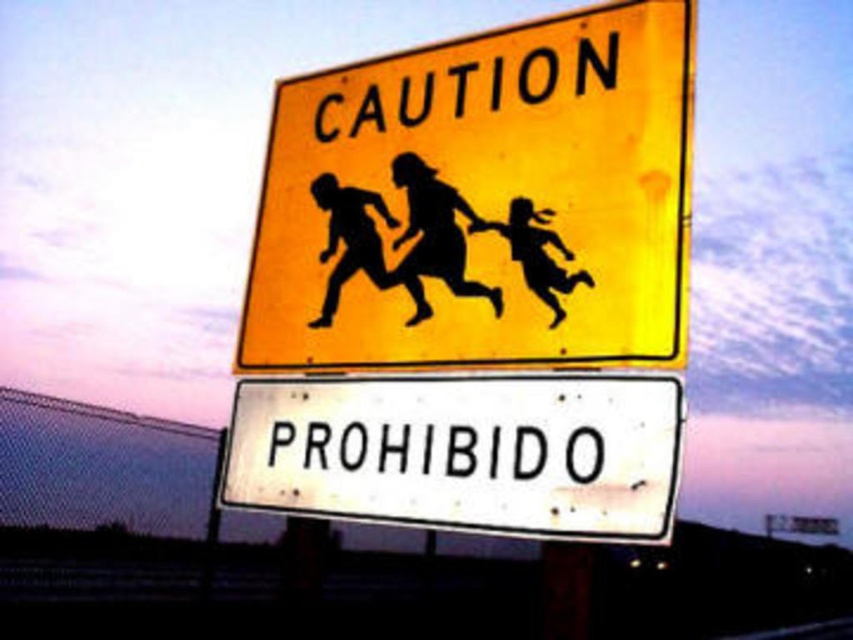
Question: Can you confirm if yellow matte caution sign at upper center is positioned to the right of white matte sign at center?

Choices:
 (A) no
 (B) yes

Answer: (B)

Question: Is yellow matte caution sign at upper center above white matte sign at center?

Choices:
 (A) yes
 (B) no

Answer: (A)

Question: Which object appears farthest from the camera in this image?

Choices:
 (A) white matte sign at center
 (B) yellow matte caution sign at upper center

Answer: (B)

Question: Does yellow matte caution sign at upper center appear under white matte sign at center?

Choices:
 (A) no
 (B) yes

Answer: (A)